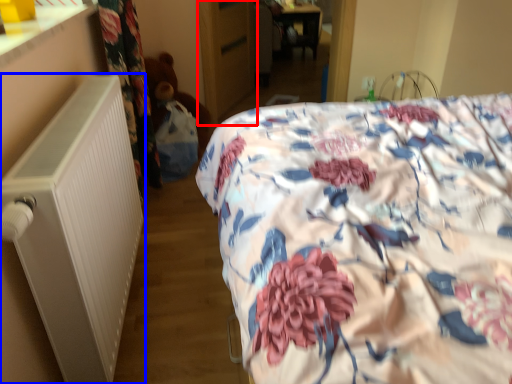
Question: Which object is further to the camera taking this photo, armoire (highlighted by a red box) or radiator (highlighted by a blue box)?

Choices:
 (A) armoire
 (B) radiator

Answer: (A)